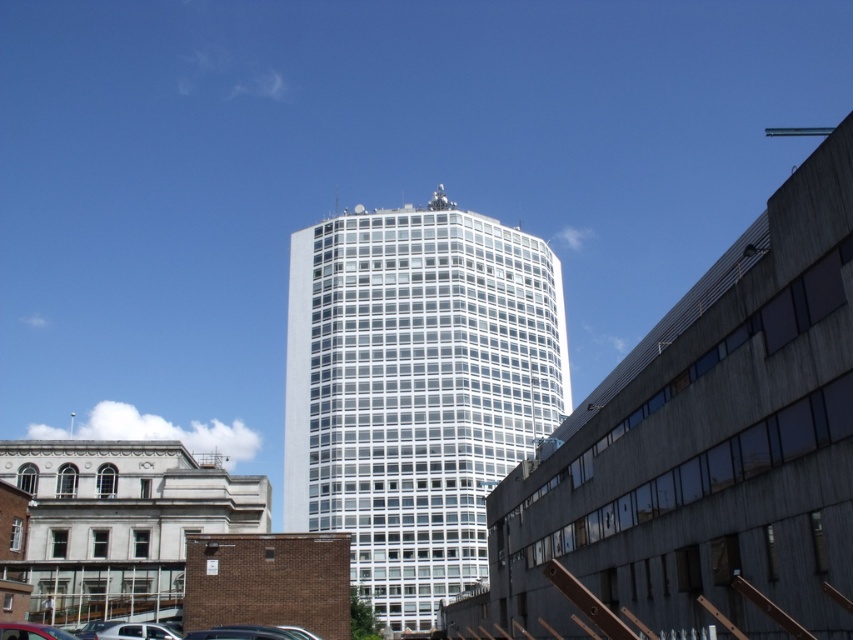
Question: Which of these objects is positioned farthest from the white glossy car at lower left?

Choices:
 (A) matte red car at lower left
 (B) white glass tower at center

Answer: (B)

Question: Is white glossy car at lower left to the left of matte red car at lower left from the viewer's perspective?

Choices:
 (A) no
 (B) yes

Answer: (A)

Question: Can you confirm if white glossy car at lower left is smaller than matte red car at lower left?

Choices:
 (A) yes
 (B) no

Answer: (A)

Question: Which object appears farthest from the camera in this image?

Choices:
 (A) white glass tower at center
 (B) white glossy car at lower left
 (C) matte red car at lower left

Answer: (A)

Question: Observing the image, what is the correct spatial positioning of white glass tower at center in reference to matte red car at lower left?

Choices:
 (A) right
 (B) left

Answer: (A)

Question: Estimate the real-world distances between objects in this image. Which object is closer to the white glossy car at lower left?

Choices:
 (A) white glass tower at center
 (B) matte red car at lower left

Answer: (B)